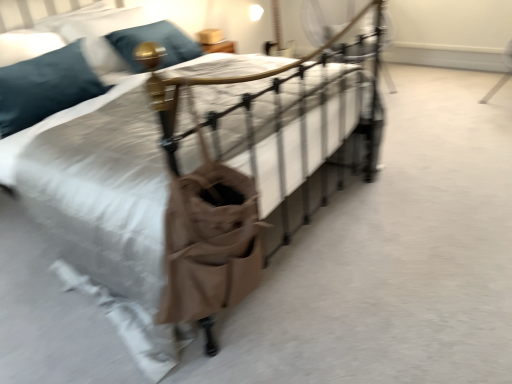
Question: Should I look upward or downward to see teal velvet pillow at upper left, which ranks as the first pillow in back-to-front order?

Choices:
 (A) down
 (B) up

Answer: (B)

Question: Does teal velvet pillow at upper left, which ranks as the first pillow in back-to-front order, have a smaller size compared to teal fabric pillow at upper left, the 2th pillow from the back?

Choices:
 (A) yes
 (B) no

Answer: (A)

Question: Does teal velvet pillow at upper left, the second pillow in the front-to-back sequence, have a lesser height compared to teal fabric pillow at upper left, the first pillow positioned from the front?

Choices:
 (A) no
 (B) yes

Answer: (B)

Question: Is teal velvet pillow at upper left, which ranks as the first pillow in back-to-front order, outside of teal fabric pillow at upper left, the 2th pillow from the back?

Choices:
 (A) yes
 (B) no

Answer: (A)

Question: From a real-world perspective, is teal velvet pillow at upper left, the second pillow in the front-to-back sequence, physically above teal fabric pillow at upper left, the first pillow positioned from the front?

Choices:
 (A) yes
 (B) no

Answer: (A)

Question: Considering the relative positions of teal velvet pillow at upper left, which ranks as the first pillow in back-to-front order, and teal fabric pillow at upper left, the first pillow positioned from the front, in the image provided, is teal velvet pillow at upper left, which ranks as the first pillow in back-to-front order, in front of teal fabric pillow at upper left, the first pillow positioned from the front,?

Choices:
 (A) no
 (B) yes

Answer: (A)

Question: Does teal velvet pillow at upper left, the second pillow in the front-to-back sequence, appear on the left side of teal fabric pillow at upper left, the first pillow positioned from the front?

Choices:
 (A) yes
 (B) no

Answer: (B)

Question: Is teal fabric pillow at upper left, the 2th pillow from the back, aimed at teal velvet pillow at upper left, which ranks as the first pillow in back-to-front order?

Choices:
 (A) yes
 (B) no

Answer: (B)

Question: Can you confirm if teal fabric pillow at upper left, the 2th pillow from the back, is taller than teal velvet pillow at upper left, the second pillow in the front-to-back sequence?

Choices:
 (A) no
 (B) yes

Answer: (B)

Question: Considering the relative positions of teal fabric pillow at upper left, the first pillow positioned from the front, and teal velvet pillow at upper left, the second pillow in the front-to-back sequence, in the image provided, is teal fabric pillow at upper left, the first pillow positioned from the front, to the left of teal velvet pillow at upper left, the second pillow in the front-to-back sequence, from the viewer's perspective?

Choices:
 (A) yes
 (B) no

Answer: (A)

Question: From a real-world perspective, is teal fabric pillow at upper left, the 2th pillow from the back, beneath teal velvet pillow at upper left, which ranks as the first pillow in back-to-front order?

Choices:
 (A) no
 (B) yes

Answer: (B)

Question: From the image's perspective, would you say teal fabric pillow at upper left, the 2th pillow from the back, is shown under teal velvet pillow at upper left, the second pillow in the front-to-back sequence?

Choices:
 (A) no
 (B) yes

Answer: (B)

Question: From the image's perspective, is teal fabric pillow at upper left, the 2th pillow from the back, on top of teal velvet pillow at upper left, the second pillow in the front-to-back sequence?

Choices:
 (A) no
 (B) yes

Answer: (A)

Question: From the image's perspective, is teal fabric pillow at upper left, the first pillow positioned from the front, located above or below teal velvet pillow at upper left, which ranks as the first pillow in back-to-front order?

Choices:
 (A) above
 (B) below

Answer: (B)